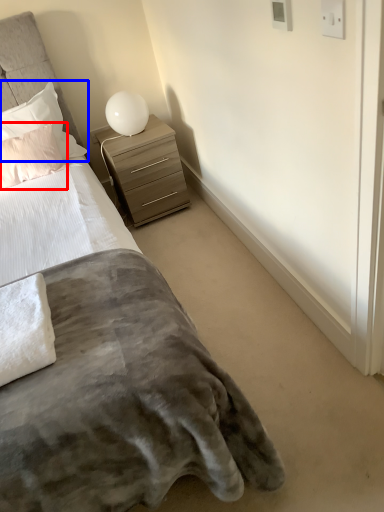
Question: Which of the following is the closest to the observer, pillow (highlighted by a red box) or pillow (highlighted by a blue box)?

Choices:
 (A) pillow
 (B) pillow

Answer: (A)